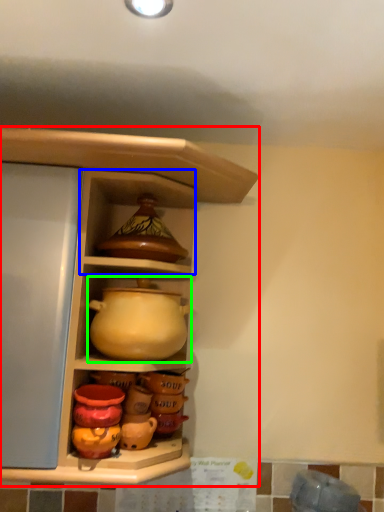
Question: Which object is the closest to the shelf (highlighted by a red box)? Choose among these: cabinet (highlighted by a blue box) or jug (highlighted by a green box).

Choices:
 (A) cabinet
 (B) jug

Answer: (A)